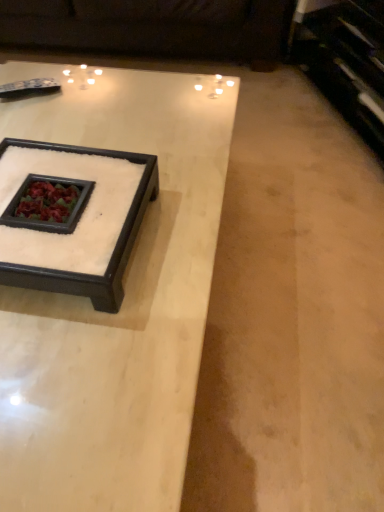
Locate an element on the screen. The height and width of the screenshot is (512, 384). white marble coffee table at center, the second coffee table from the back is located at coordinates (122, 304).

The width and height of the screenshot is (384, 512). I want to click on white marble tray at center, the first coffee table when ordered from back to front, so click(114, 249).

Which object is further away from the camera taking this photo, white marble tray at center, the first coffee table when ordered from back to front, or dark brown leather couch at upper center?

Positioned behind is dark brown leather couch at upper center.

Does white marble tray at center, the first coffee table when ordered from back to front, turn towards dark brown leather couch at upper center?

No, white marble tray at center, the first coffee table when ordered from back to front, is not turned towards dark brown leather couch at upper center.

Does white marble tray at center, acting as the second coffee table starting from the front, have a larger size compared to dark brown leather couch at upper center?

Incorrect, white marble tray at center, acting as the second coffee table starting from the front, is not larger than dark brown leather couch at upper center.

From their relative heights in the image, would you say white marble tray at center, the first coffee table when ordered from back to front, is taller or shorter than dark brown leather couch at upper center?

Considering their sizes, white marble tray at center, the first coffee table when ordered from back to front, has less height than dark brown leather couch at upper center.

The height and width of the screenshot is (512, 384). In order to click on the 2nd coffee table counting from the right of the dark brown leather couch at upper center in this screenshot , I will do `click(114, 249)`.

Is dark brown leather couch at upper center situated inside white marble tray at center, the first coffee table when ordered from back to front, or outside?

dark brown leather couch at upper center lies outside white marble tray at center, the first coffee table when ordered from back to front.

From the image's perspective, would you say dark brown leather couch at upper center is shown under white marble tray at center, the first coffee table when ordered from back to front?

Actually, dark brown leather couch at upper center appears above white marble tray at center, the first coffee table when ordered from back to front, in the image.

Is dark brown leather couch at upper center beside white marble coffee table at center, which ranks as the first coffee table in front-to-back order?

No, dark brown leather couch at upper center is not making contact with white marble coffee table at center, which ranks as the first coffee table in front-to-back order.

Considering their positions, is dark brown leather couch at upper center located in front of or behind white marble coffee table at center, which ranks as the first coffee table in front-to-back order?

Clearly, dark brown leather couch at upper center is behind white marble coffee table at center, which ranks as the first coffee table in front-to-back order.

How many degrees apart are the facing directions of dark brown leather couch at upper center and white marble coffee table at center, which ranks as the first coffee table in front-to-back order?

They differ by 89.5 degrees in their facing directions.

From the picture: Is white marble coffee table at center, the second coffee table from the back, not inside dark brown leather couch at upper center?

white marble coffee table at center, the second coffee table from the back, lies outside dark brown leather couch at upper center's area.

Based on the photo, considering the sizes of white marble coffee table at center, the second coffee table from the back, and dark brown leather couch at upper center in the image, is white marble coffee table at center, the second coffee table from the back, bigger or smaller than dark brown leather couch at upper center?

Clearly, white marble coffee table at center, the second coffee table from the back, is smaller in size than dark brown leather couch at upper center.

Is white marble coffee table at center, which ranks as the first coffee table in front-to-back order, facing away from dark brown leather couch at upper center?

No, dark brown leather couch at upper center is not at the back of white marble coffee table at center, which ranks as the first coffee table in front-to-back order.

From the image's perspective, between white marble coffee table at center, the second coffee table from the back, and dark brown leather couch at upper center, which one is located above?

dark brown leather couch at upper center appears higher in the image.

Does point (164, 489) lie in front of point (121, 300)?

Yes, point (164, 489) is in front of point (121, 300).

Is white marble coffee table at center, which ranks as the first coffee table in front-to-back order, surrounding white marble tray at center, the first coffee table when ordered from back to front?

No, white marble tray at center, the first coffee table when ordered from back to front, is located outside of white marble coffee table at center, which ranks as the first coffee table in front-to-back order.

Considering the positions of objects white marble coffee table at center, the second coffee table from the back, and white marble tray at center, acting as the second coffee table starting from the front, in the image provided, who is in front, white marble coffee table at center, the second coffee table from the back, or white marble tray at center, acting as the second coffee table starting from the front,?

white marble coffee table at center, the second coffee table from the back, is more forward.

This screenshot has height=512, width=384. What are the coordinates of `coffee table above the white marble coffee table at center, the second coffee table from the back (from a real-world perspective)` in the screenshot? It's located at (114, 249).

Does white marble tray at center, acting as the second coffee table starting from the front, have a greater width compared to white marble coffee table at center, which ranks as the first coffee table in front-to-back order?

No, white marble tray at center, acting as the second coffee table starting from the front, is not wider than white marble coffee table at center, which ranks as the first coffee table in front-to-back order.

Between point (131, 236) and point (162, 492), which one is positioned in front?

Positioned in front is point (162, 492).

Is white marble tray at center, the first coffee table when ordered from back to front, oriented towards white marble coffee table at center, the second coffee table from the back?

No, white marble tray at center, the first coffee table when ordered from back to front, is not aimed at white marble coffee table at center, the second coffee table from the back.

I want to click on coffee table above the white marble coffee table at center, the second coffee table from the back (from a real-world perspective), so click(114, 249).

Identify the location of couch below the white marble tray at center, the first coffee table when ordered from back to front (from a real-world perspective). This screenshot has height=512, width=384. (153, 28).

Locate an element on the screen. The width and height of the screenshot is (384, 512). the 2nd coffee table to the right when counting from the dark brown leather couch at upper center is located at coordinates (114, 249).

Estimate the real-world distances between objects in this image. Which object is closer to white marble tray at center, the first coffee table when ordered from back to front, dark brown leather couch at upper center or white marble coffee table at center, which ranks as the first coffee table in front-to-back order?

white marble coffee table at center, which ranks as the first coffee table in front-to-back order, is positioned closer to the anchor white marble tray at center, the first coffee table when ordered from back to front.

Based on their spatial positions, is white marble coffee table at center, which ranks as the first coffee table in front-to-back order, or white marble tray at center, acting as the second coffee table starting from the front, closer to dark brown leather couch at upper center?

white marble coffee table at center, which ranks as the first coffee table in front-to-back order, is positioned closer to the anchor dark brown leather couch at upper center.

Based on their spatial positions, is dark brown leather couch at upper center or white marble tray at center, acting as the second coffee table starting from the front, further from white marble coffee table at center, which ranks as the first coffee table in front-to-back order?

Answer: dark brown leather couch at upper center.

Which object lies further to the anchor point dark brown leather couch at upper center, white marble tray at center, the first coffee table when ordered from back to front, or white marble coffee table at center, the second coffee table from the back?

white marble tray at center, the first coffee table when ordered from back to front.

When comparing their distances from white marble tray at center, the first coffee table when ordered from back to front, does white marble coffee table at center, the second coffee table from the back, or dark brown leather couch at upper center seem further?

Based on the image, dark brown leather couch at upper center appears to be further to white marble tray at center, the first coffee table when ordered from back to front.

Which object lies nearer to the anchor point white marble coffee table at center, the second coffee table from the back, white marble tray at center, acting as the second coffee table starting from the front, or dark brown leather couch at upper center?

white marble tray at center, acting as the second coffee table starting from the front.

This screenshot has height=512, width=384. Find the location of `coffee table between dark brown leather couch at upper center and white marble coffee table at center, the second coffee table from the back, vertically`. coffee table between dark brown leather couch at upper center and white marble coffee table at center, the second coffee table from the back, vertically is located at coordinates (114, 249).